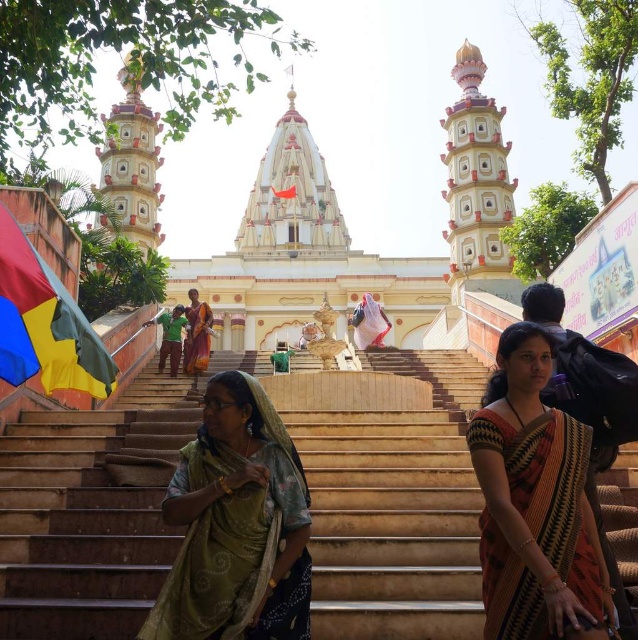
Is black woven saree at center bigger than matte cream tower at upper left?

Actually, black woven saree at center might be smaller than matte cream tower at upper left.

Between black woven saree at center and matte cream tower at upper left, which one has less height?

With less height is black woven saree at center.

Locate an element on the screen. Image resolution: width=638 pixels, height=640 pixels. black woven saree at center is located at coordinates (535, 504).

Is white painted stone tower at upper center closer to camera compared to orange fabric saree at center?

No, it is behind orange fabric saree at center.

Is white painted stone tower at upper center smaller than orange fabric saree at center?

No.

At what (x,y) coordinates should I click in order to perform the action: click on white painted stone tower at upper center. Please return your answer as a coordinate pair (x, y). Image resolution: width=638 pixels, height=640 pixels. Looking at the image, I should click on (475, 177).

At what (x,y) coordinates should I click in order to perform the action: click on white painted stone tower at upper center. Please return your answer as a coordinate pair (x, y). Image resolution: width=638 pixels, height=640 pixels. Looking at the image, I should click on (475, 177).

Between point (167, 448) and point (494, 275), which one is positioned in front?

Point (167, 448) is more forward.

Can you confirm if beige stone stairs at center is wider than white painted stone tower at upper center?

Yes, beige stone stairs at center is wider than white painted stone tower at upper center.

Does point (4, 628) lie behind point (484, 196)?

No, it is not.

The image size is (638, 640). Find the location of `beige stone stairs at center`. beige stone stairs at center is located at coordinates (396, 508).